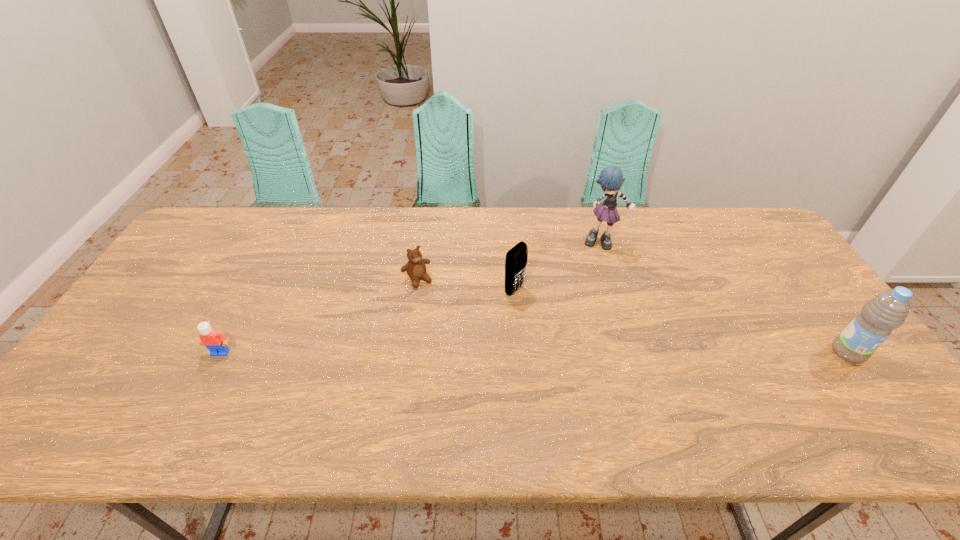
This screenshot has height=540, width=960. In order to click on free spot located at the face of the second object from left to right in this screenshot , I will do `click(450, 334)`.

Locate an element on the screen. The image size is (960, 540). vacant area situated at the face of the second object from left to right is located at coordinates (453, 339).

Find the location of a particular element. This screenshot has width=960, height=540. vacant space situated 0.070m at the face of the second object from left to right is located at coordinates (433, 304).

Image resolution: width=960 pixels, height=540 pixels. Identify the location of vacant space located on the screen of the third object from left to right. (593, 338).

Image resolution: width=960 pixels, height=540 pixels. Identify the location of free location located 0.130m on the screen of the third object from left to right. (562, 319).

Find the location of `vacant space located 0.190m on the screen of the third object from left to right`. vacant space located 0.190m on the screen of the third object from left to right is located at coordinates (581, 330).

This screenshot has width=960, height=540. In order to click on blank area located on the front-facing side of the tallest object in this screenshot , I will do `click(607, 286)`.

The width and height of the screenshot is (960, 540). Identify the location of vacant space located on the front-facing side of the tallest object. (608, 291).

Where is `vacant space located 0.160m on the front-facing side of the tallest object`? This screenshot has width=960, height=540. vacant space located 0.160m on the front-facing side of the tallest object is located at coordinates (607, 286).

Locate an element on the screen. object that is at the far edge is located at coordinates (611, 178).